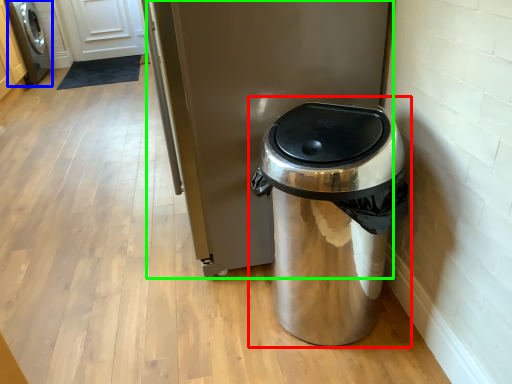
Question: Which object is the farthest from waste container (highlighted by a red box)? Choose among these: washing machine (highlighted by a blue box) or appliance (highlighted by a green box).

Choices:
 (A) washing machine
 (B) appliance

Answer: (A)